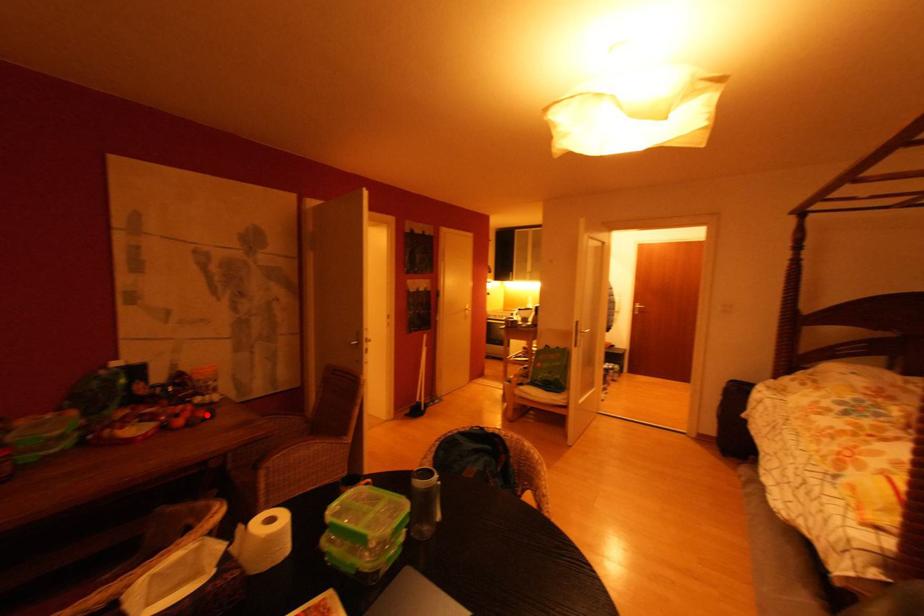
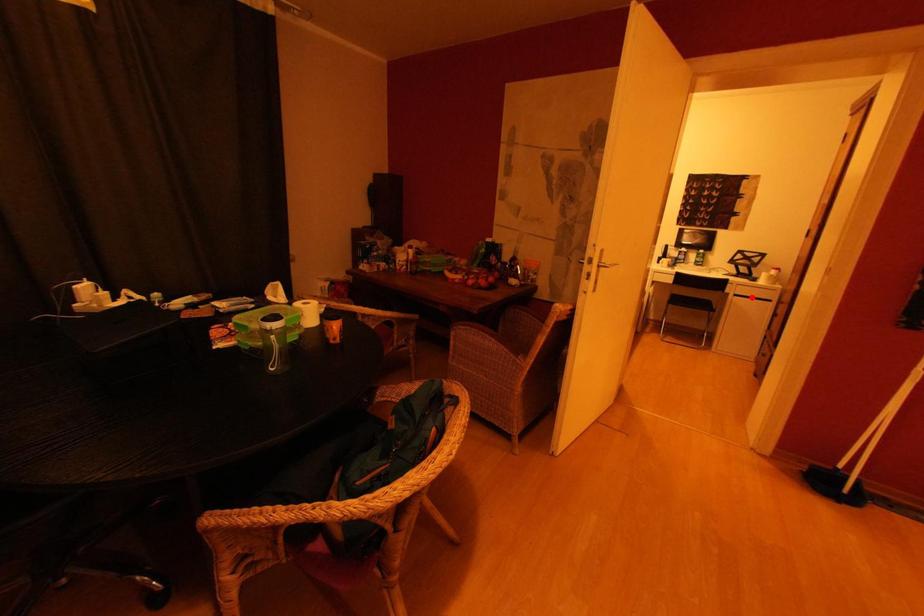
I am providing you with two images of the same scene from different viewpoints. A red point is marked on the first image and another point is marked on the second image. Are the points marked in image1 and image2 representing the same 3D position?

No